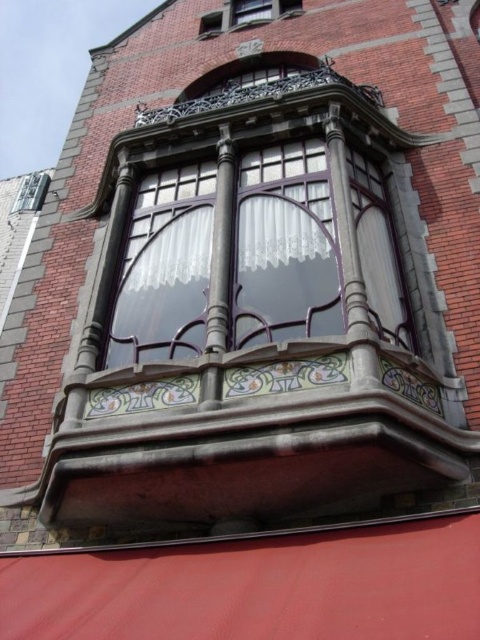
You are standing in front of a building with an Art Nouveau bay window. You notice two points marked on the facade. The first point is at coordinates point (248, 252) and the second is at point (247, 1). If you were to walk directly towards the building, which point would appear closer to you?

Point (248, 252) is in front of point (247, 1), so it would appear closer to you as you walk towards the building.